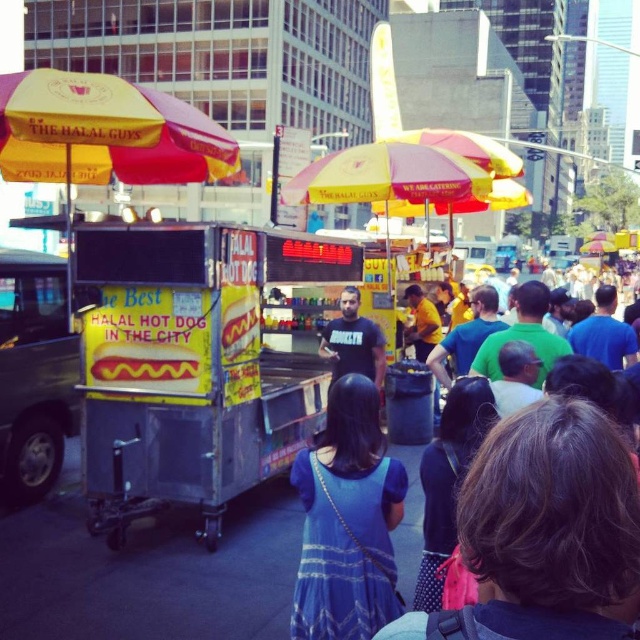
Is yellow fabric umbrella at upper left smaller than yellow matte hot dog at center?

Actually, yellow fabric umbrella at upper left might be larger than yellow matte hot dog at center.

Is point (140, 99) in front of point (116, 376)?

Yes, it is.

At what (x,y) coordinates should I click in order to perform the action: click on yellow fabric umbrella at upper left. Please return your answer as a coordinate pair (x, y). Looking at the image, I should click on (106, 132).

Looking at this image, is rusty metal hot dog cart at center shorter than yellow matte hot dog at center?

No.

Does point (259, 464) come closer to viewer compared to point (104, 378)?

No, it is behind (104, 378).

Find the location of `rusty metal hot dog cart at center`. rusty metal hot dog cart at center is located at coordinates (200, 374).

Measure the distance from rusty metal hot dog cart at center to yellow fabric umbrella at upper left.

The distance of rusty metal hot dog cart at center from yellow fabric umbrella at upper left is 4.84 feet.

Which is in front, point (250, 310) or point (186, 109)?

Point (250, 310) is more forward.

You are a GUI agent. You are given a task and a screenshot of the screen. Output one action in this format:
    pyautogui.click(x=<x>, y=<y>)
    Task: Click on the rusty metal hot dog cart at center
    Image resolution: width=640 pixels, height=640 pixels.
    Given the screenshot: What is the action you would take?
    pyautogui.click(x=200, y=374)